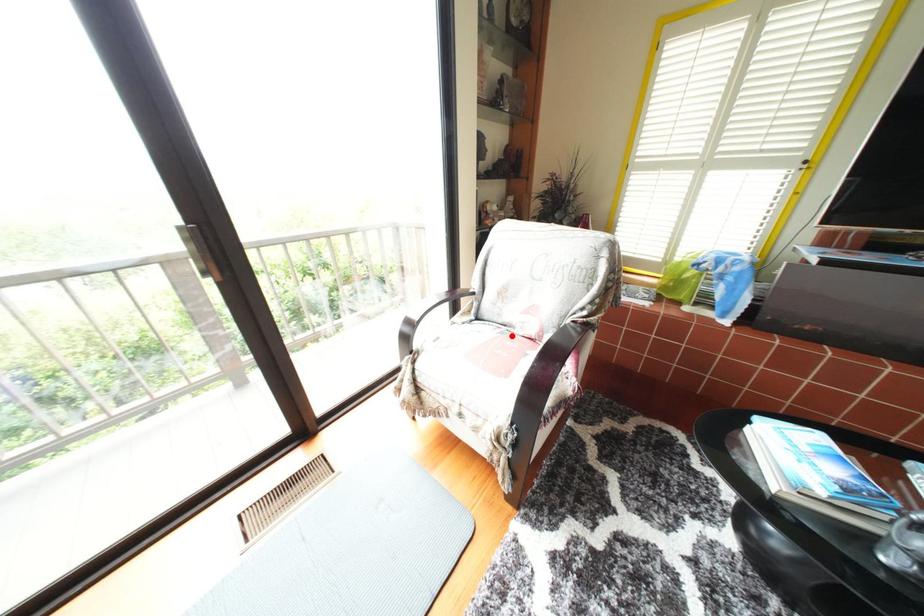
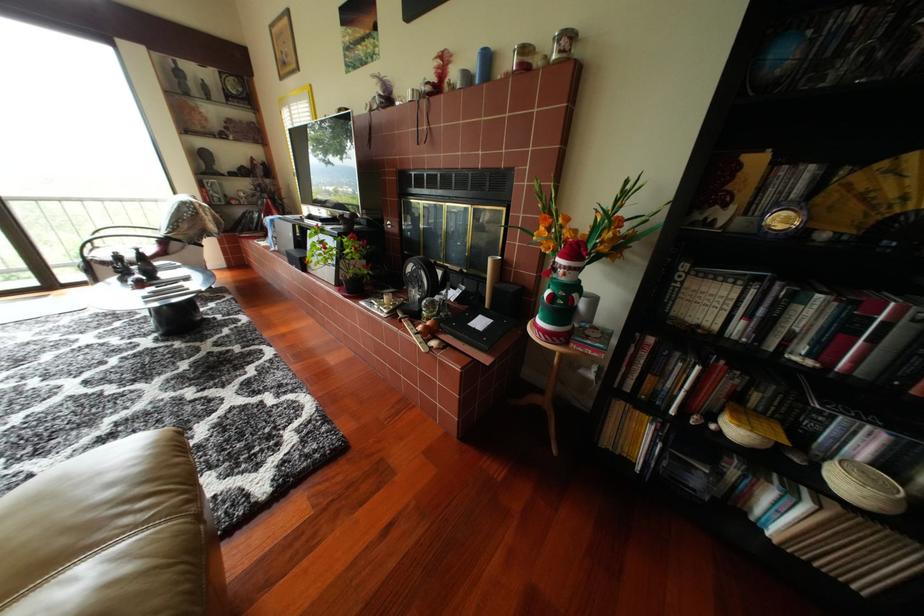
Question: I am providing you with two images of the same scene from different viewpoints. A red point is marked on the first image. At the location where the point appears in image 1, is it still visible in image 2?

Choices:
 (A) Yes
 (B) No

Answer: (B)